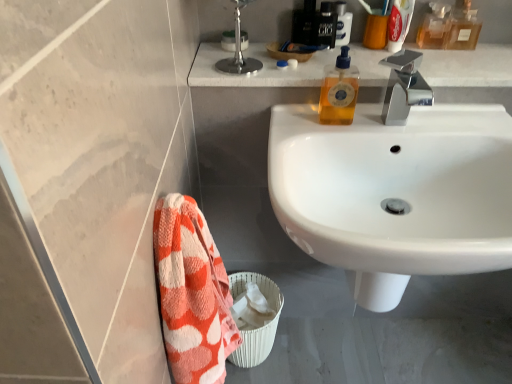
You are a GUI agent. You are given a task and a screenshot of the screen. Output one action in this format:
    pyautogui.click(x=<x>, y=<y>)
    Task: Click on the vacant point to the right of polished chrome faucet at upper right
    The image size is (512, 384).
    Given the screenshot: What is the action you would take?
    pyautogui.click(x=455, y=123)